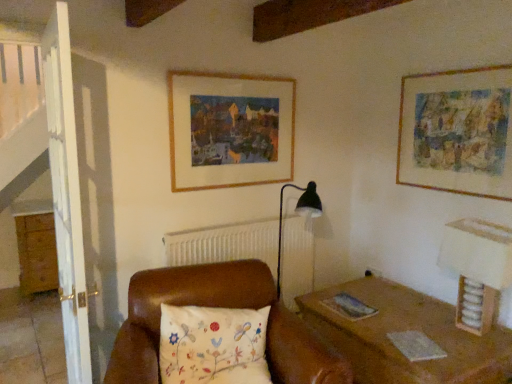
Question: Can you confirm if wooden frame at upper center, positioned as the first picture frame in left-to-right order, is bigger than floral-patterned fabric pillow at center?

Choices:
 (A) yes
 (B) no

Answer: (B)

Question: Is the depth of wooden frame at upper center, placed as the second picture frame when sorted from right to left, greater than that of floral-patterned fabric pillow at center?

Choices:
 (A) yes
 (B) no

Answer: (A)

Question: From the image's perspective, is wooden frame at upper center, positioned as the first picture frame in left-to-right order, beneath floral-patterned fabric pillow at center?

Choices:
 (A) yes
 (B) no

Answer: (B)

Question: Is wooden frame at upper center, placed as the second picture frame when sorted from right to left, aimed at floral-patterned fabric pillow at center?

Choices:
 (A) no
 (B) yes

Answer: (A)

Question: Is wooden frame at upper center, positioned as the first picture frame in left-to-right order, positioned far away from floral-patterned fabric pillow at center?

Choices:
 (A) yes
 (B) no

Answer: (A)

Question: Is point (419, 77) positioned closer to the camera than point (482, 258)?

Choices:
 (A) farther
 (B) closer

Answer: (A)

Question: From the image's perspective, is watercolor paper painting at upper right, acting as the 2th picture frame starting from the left, above or below wooden table lamp at right?

Choices:
 (A) below
 (B) above

Answer: (B)

Question: Would you say watercolor paper painting at upper right, acting as the 2th picture frame starting from the left, is inside or outside wooden table lamp at right?

Choices:
 (A) outside
 (B) inside

Answer: (A)

Question: Looking at their shapes, would you say watercolor paper painting at upper right, the 1th picture frame positioned from the right, is wider or thinner than wooden table lamp at right?

Choices:
 (A) wide
 (B) thin

Answer: (B)

Question: In the image, is wooden table lamp at right positioned in front of or behind watercolor paper painting at upper right, the 1th picture frame positioned from the right?

Choices:
 (A) front
 (B) behind

Answer: (A)

Question: Would you say wooden table lamp at right is to the left or to the right of watercolor paper painting at upper right, the 1th picture frame positioned from the right, in the picture?

Choices:
 (A) left
 (B) right

Answer: (B)

Question: Considering the positions of wooden table lamp at right and watercolor paper painting at upper right, the 1th picture frame positioned from the right, in the image, is wooden table lamp at right wider or thinner than watercolor paper painting at upper right, the 1th picture frame positioned from the right,?

Choices:
 (A) thin
 (B) wide

Answer: (B)

Question: From their relative heights in the image, would you say wooden table lamp at right is taller or shorter than watercolor paper painting at upper right, acting as the 2th picture frame starting from the left?

Choices:
 (A) tall
 (B) short

Answer: (B)

Question: In the image, is wooden dresser at left on the left side or the right side of floral-patterned fabric pillow at center?

Choices:
 (A) right
 (B) left

Answer: (B)

Question: Is point (29, 271) positioned closer to the camera than point (231, 312)?

Choices:
 (A) farther
 (B) closer

Answer: (A)